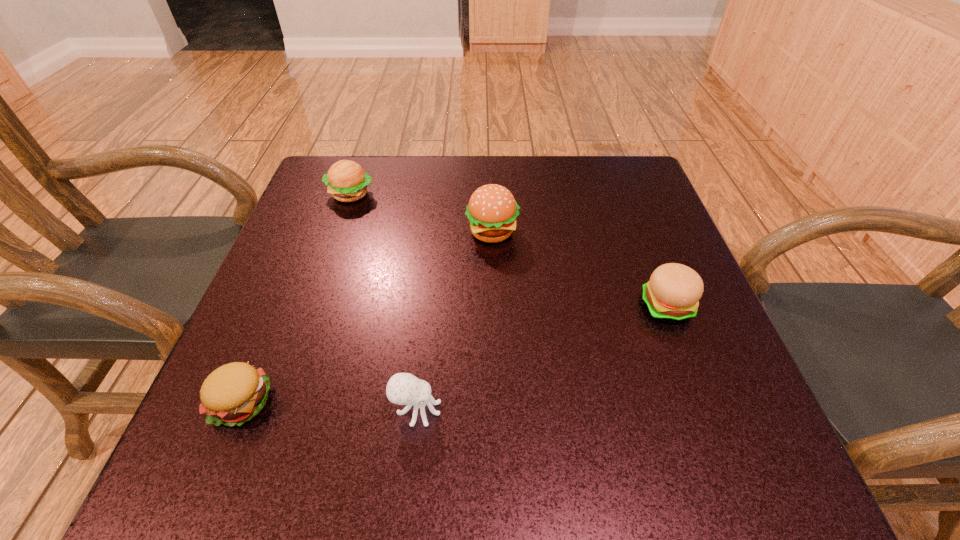
Locate which hamburger ranks in proximity to the farthest object. Please provide its 2D coordinates. Your answer should be formatted as a tuple, i.e. [(x, y)], where the tuple contains the x and y coordinates of a point satisfying the conditions above.

[(492, 210)]

Where is `vacant space that satisfies the following two spatial constraints: 1. on the back side of the shortest object; 2. on the left side of the farthest object`? This screenshot has width=960, height=540. vacant space that satisfies the following two spatial constraints: 1. on the back side of the shortest object; 2. on the left side of the farthest object is located at coordinates (326, 194).

Identify the location of vacant point that satisfies the following two spatial constraints: 1. on the front side of the fourth nearest object; 2. on the left side of the rightmost object. This screenshot has width=960, height=540. (494, 306).